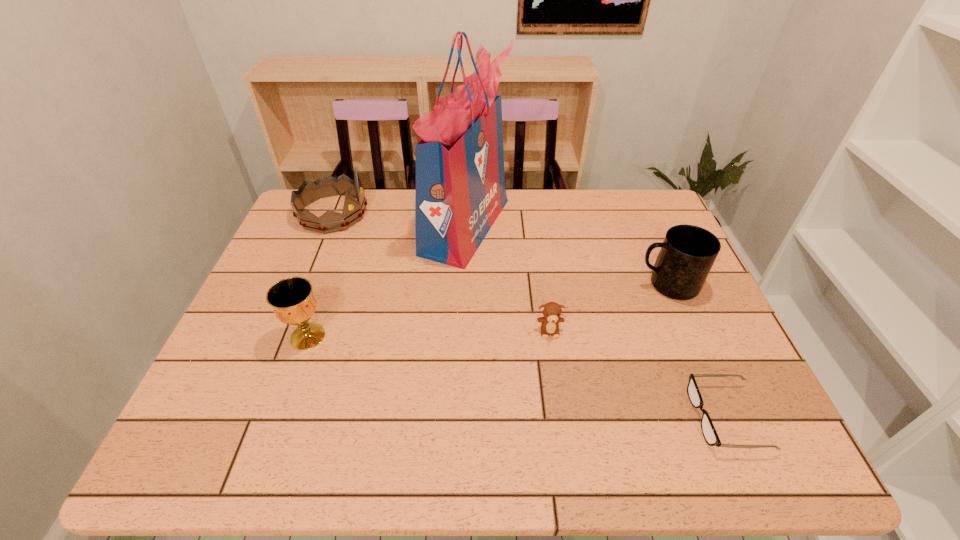
At what (x,y) coordinates should I click in order to perform the action: click on vacant space in between the chalice and the tiara. Please return your answer as a coordinate pair (x, y). The width and height of the screenshot is (960, 540). Looking at the image, I should click on (321, 275).

I want to click on free space between the chalice and the mug, so click(x=488, y=310).

You are a GUI agent. You are given a task and a screenshot of the screen. Output one action in this format:
    pyautogui.click(x=<x>, y=<y>)
    Task: Click on the free space between the mug and the tiara
    
    Given the screenshot: What is the action you would take?
    pyautogui.click(x=500, y=249)

Where is `free spot between the grocery bag and the teddy bear`? free spot between the grocery bag and the teddy bear is located at coordinates (508, 278).

This screenshot has width=960, height=540. Identify the location of object that is the fourth nearest to the chalice. (688, 252).

Choose which object is the second nearest neighbor to the mug. Please provide its 2D coordinates. Your answer should be formatted as a tuple, i.e. [(x, y)], where the tuple contains the x and y coordinates of a point satisfying the conditions above.

[(710, 435)]

Where is `vacant position in the image that satisfies the following two spatial constraints: 1. on the front-facing side of the tallest object; 2. on the front side of the chalice`? The width and height of the screenshot is (960, 540). vacant position in the image that satisfies the following two spatial constraints: 1. on the front-facing side of the tallest object; 2. on the front side of the chalice is located at coordinates (461, 336).